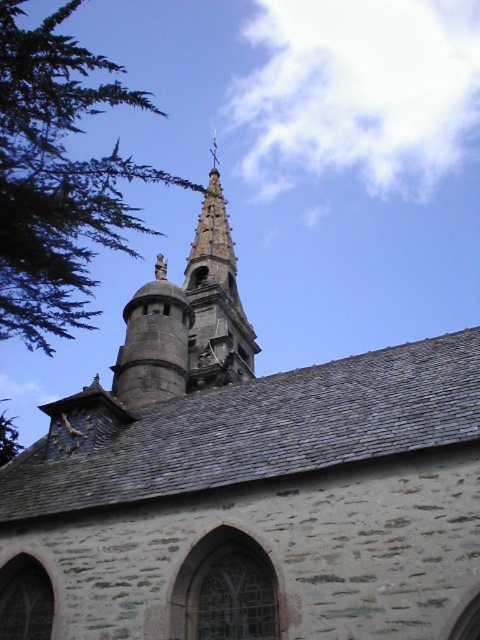
Question: Is green leafy tree at upper left positioned before smooth stone bell tower at upper center?

Choices:
 (A) no
 (B) yes

Answer: (B)

Question: Which point is farther to the camera?

Choices:
 (A) green leafy tree at upper left
 (B) smooth stone bell tower at upper center

Answer: (B)

Question: Which point appears farthest from the camera in this image?

Choices:
 (A) (46, 74)
 (B) (251, 342)

Answer: (B)

Question: Is green leafy tree at upper left thinner than smooth stone bell tower at upper center?

Choices:
 (A) yes
 (B) no

Answer: (B)

Question: Does green leafy tree at upper left have a larger size compared to smooth stone bell tower at upper center?

Choices:
 (A) yes
 (B) no

Answer: (A)

Question: Which point is farther to the camera?

Choices:
 (A) (211, 312)
 (B) (29, 221)

Answer: (A)